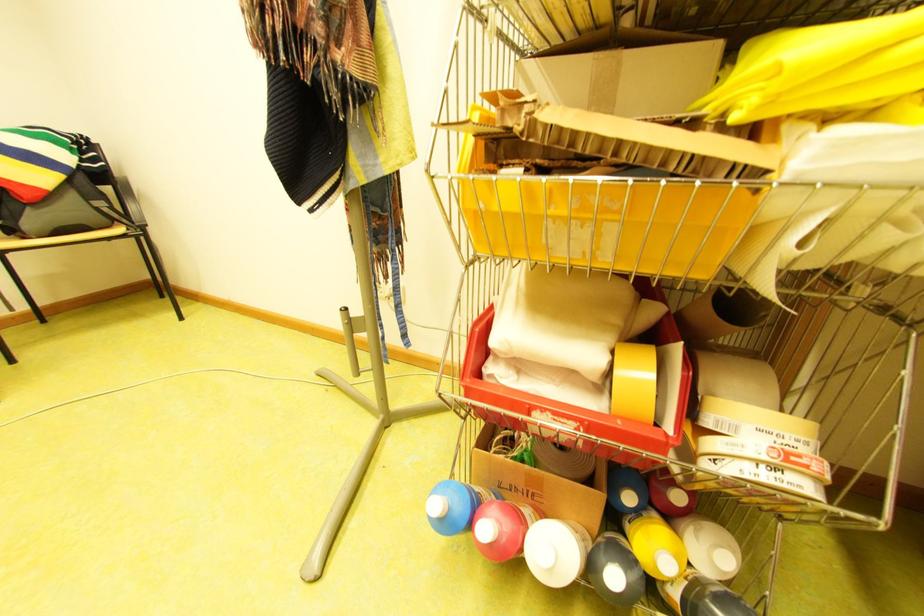
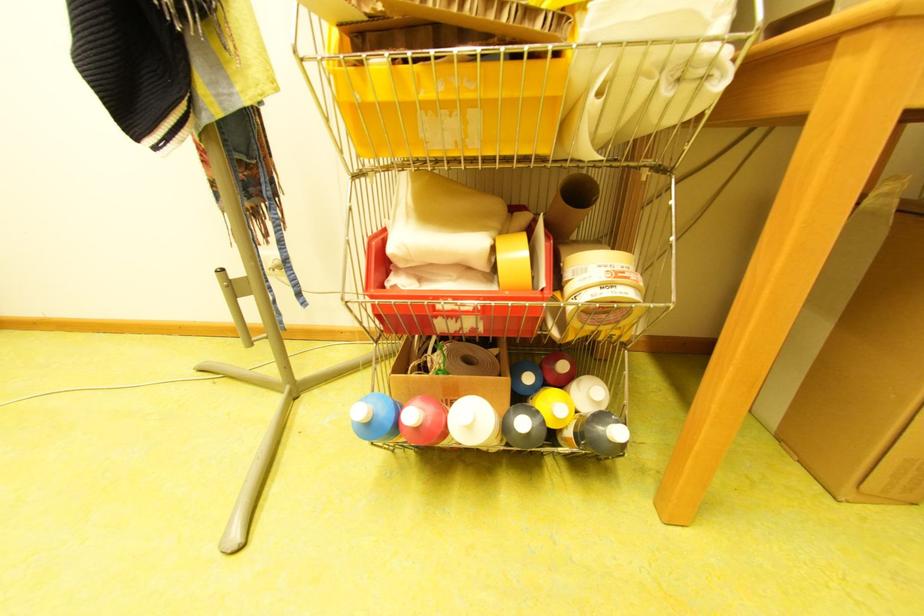
Where in the second image is the point corresponding to [561,209] from the first image?

(429, 95)